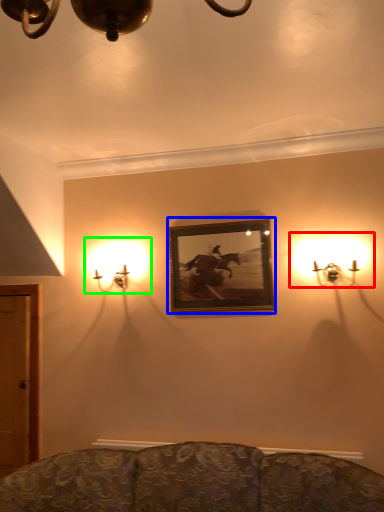
Question: Based on their relative distances, which object is nearer to lamp (highlighted by a red box)? Choose from picture frame (highlighted by a blue box) and lamp (highlighted by a green box).

Choices:
 (A) picture frame
 (B) lamp

Answer: (A)